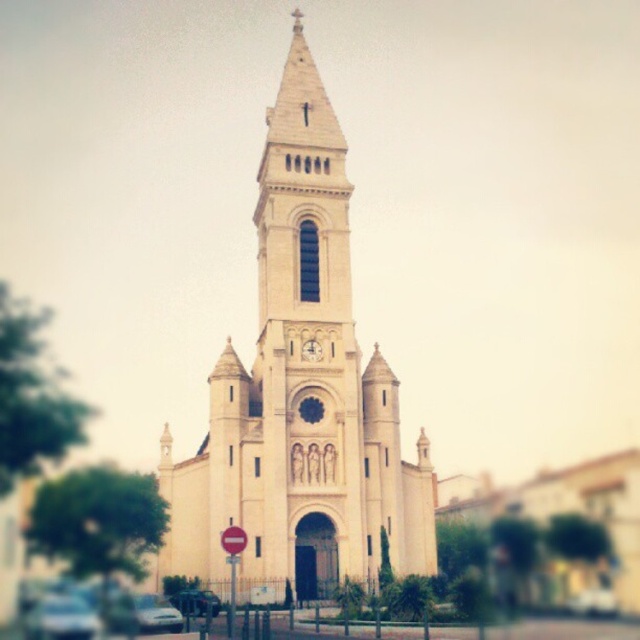
You are driving a white glossy car at lower left and want to park it directly in front of the gold metallic clock at center. Given the layout of the church, is this possible without moving any other objects?

The white glossy car at lower left is to the left of the gold metallic clock at center, so you can drive straight ahead to park directly in front of the gold metallic clock at center.